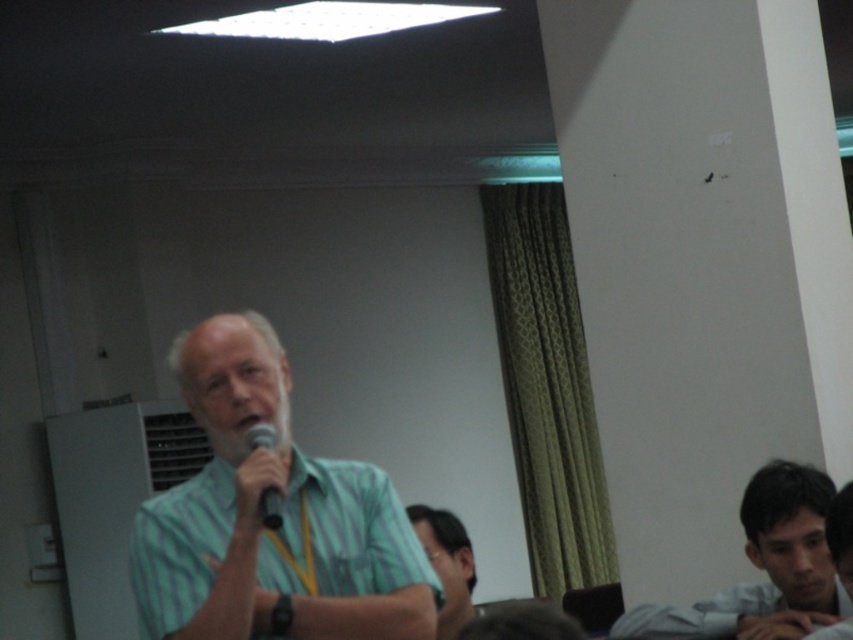
Is green striped shirt at center further to the viewer compared to light blue shirt at lower right?

No.

Is green striped shirt at center taller than light blue shirt at lower right?

Indeed, green striped shirt at center has a greater height compared to light blue shirt at lower right.

Between point (223, 362) and point (828, 502), which one is positioned behind?

Point (828, 502)

Image resolution: width=853 pixels, height=640 pixels. In order to click on green striped shirt at center in this screenshot , I will do `click(260, 522)`.

Which is more to the right, green striped shirt at center or matte green shirt at lower center?

matte green shirt at lower center is more to the right.

Which of these two, green striped shirt at center or matte green shirt at lower center, stands taller?

Standing taller between the two is green striped shirt at center.

Where is `green striped shirt at center`? This screenshot has height=640, width=853. green striped shirt at center is located at coordinates (260, 522).

I want to click on green striped shirt at center, so click(x=260, y=522).

Can you confirm if light blue shirt at lower right is taller than black matte microphone at center?

Correct, light blue shirt at lower right is much taller as black matte microphone at center.

Consider the image. Can you confirm if light blue shirt at lower right is thinner than black matte microphone at center?

No, light blue shirt at lower right is not thinner than black matte microphone at center.

Measure the distance between point (776, 504) and camera.

Point (776, 504) is 2.83 meters from camera.

Identify the location of light blue shirt at lower right. (763, 566).